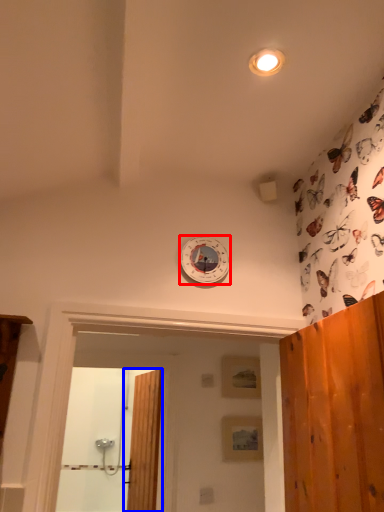
Question: Which of the following is the closest to the observer, clock (highlighted by a red box) or door (highlighted by a blue box)?

Choices:
 (A) clock
 (B) door

Answer: (A)